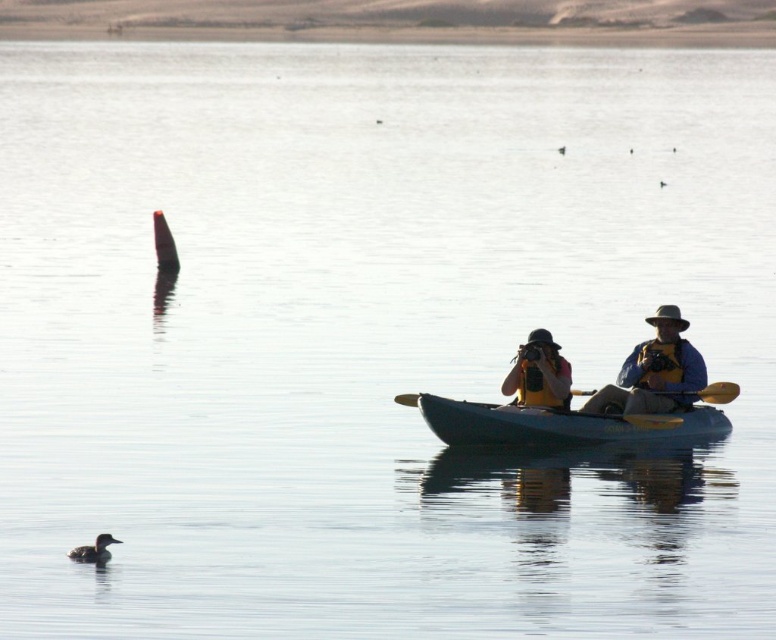
Question: Where is blue plastic kayak at center located in relation to brown fuzzy duck at lower left in the image?

Choices:
 (A) below
 (B) above

Answer: (B)

Question: Can you confirm if yellow life vest at center is positioned above brown fuzzy duck at lower left?

Choices:
 (A) yes
 (B) no

Answer: (A)

Question: Does yellow life vest at center appear on the left side of matte yellow kayak at center?

Choices:
 (A) yes
 (B) no

Answer: (B)

Question: Which of the following is the closest to the observer?

Choices:
 (A) yellow life vest at center
 (B) brown fuzzy duck at lower left

Answer: (B)

Question: Which point is closer to the camera?

Choices:
 (A) yellow wood paddle at center
 (B) yellow life vest at center
 (C) blue plastic kayak at center

Answer: (C)

Question: Considering the real-world distances, which object is closest to the brown fuzzy duck at lower left?

Choices:
 (A) yellow life vest at center
 (B) yellow wood paddle at center
 (C) matte yellow kayak at center

Answer: (C)